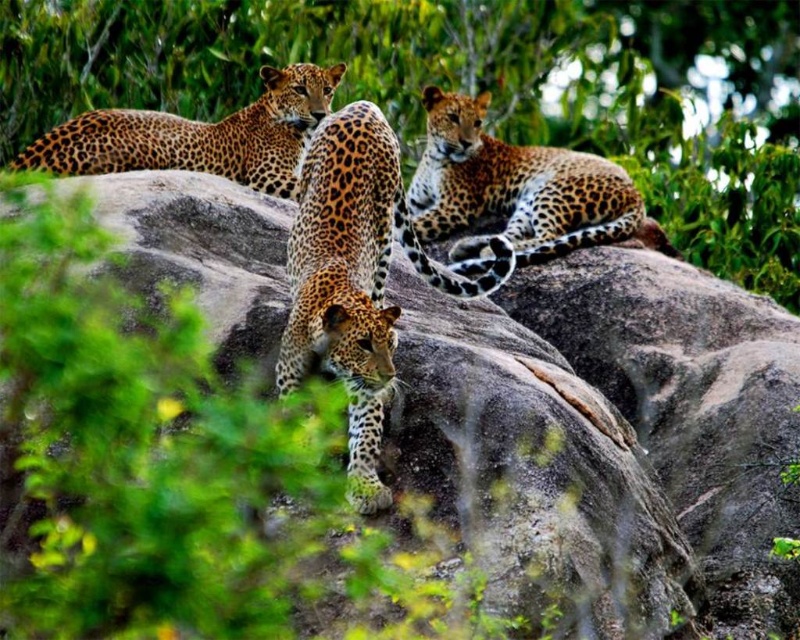
Can you confirm if gray rock at center is thinner than spotted fur cheetah at center?

No.

Does gray rock at center appear over spotted fur cheetah at center?

No.

Is point (648, 344) positioned behind point (298, 291)?

Yes, point (648, 344) is farther from viewer.

Where is `gray rock at center`? The width and height of the screenshot is (800, 640). gray rock at center is located at coordinates (612, 436).

Is spotted fur cheetah at center to the right of spotted fur cheetah at upper right from the viewer's perspective?

No, spotted fur cheetah at center is not to the right of spotted fur cheetah at upper right.

In the scene shown: Is the position of spotted fur cheetah at center more distant than that of spotted fur cheetah at upper right?

No, spotted fur cheetah at center is closer to the viewer.

Describe the element at coordinates (356, 278) in the screenshot. I see `spotted fur cheetah at center` at that location.

You are a GUI agent. You are given a task and a screenshot of the screen. Output one action in this format:
    pyautogui.click(x=<x>, y=<y>)
    Task: Click on the spotted fur cheetah at center
    
    Given the screenshot: What is the action you would take?
    pyautogui.click(x=356, y=278)

From the picture: Is gray rock at center positioned behind spotted fur cheetah at upper right?

That is False.

Locate an element on the screen. This screenshot has height=640, width=800. gray rock at center is located at coordinates (612, 436).

Is point (622, 500) farther from viewer compared to point (546, 228)?

No, (622, 500) is closer to viewer.

Locate an element on the screen. The width and height of the screenshot is (800, 640). gray rock at center is located at coordinates (612, 436).